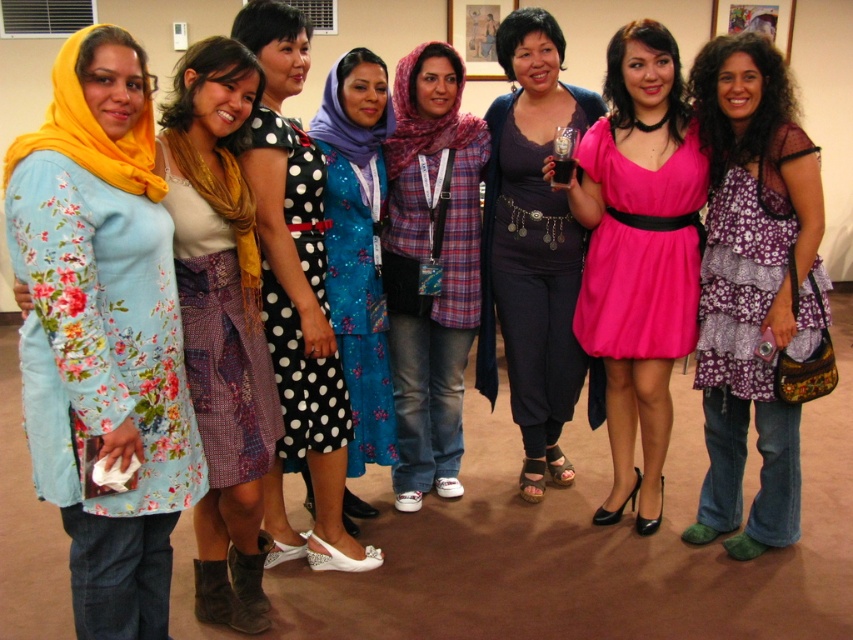
You are organizing a fashion show and need to arrange the models wearing the patchwork fabric dress at center and the black polka dot dress at center. Which dress requires a larger stage space due to its size?

The black polka dot dress at center requires more space because it is larger than the patchwork fabric dress at center.

You are organizing a photo shoot and need to ensure that the two dresses at the center are spaced exactly 8 inches apart for the camera framing. Based on the current distance between the patchwork fabric dress at center and the black polka dot dress at center, do they need to be moved closer together or farther apart?

The patchwork fabric dress at center is currently 7.94 inches from the black polka dot dress at center. Since this is slightly less than the required 8 inches, they need to be moved slightly farther apart to achieve the desired spacing.